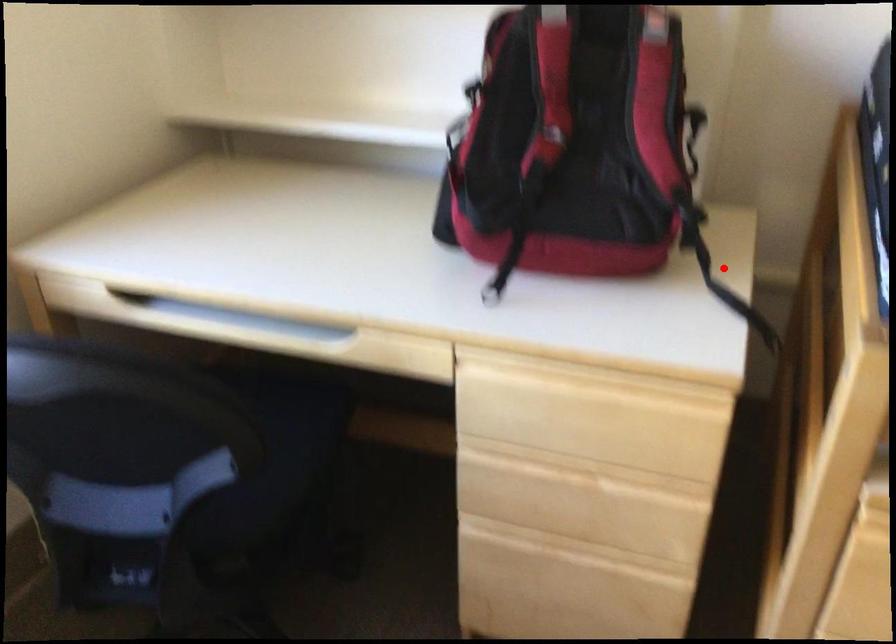
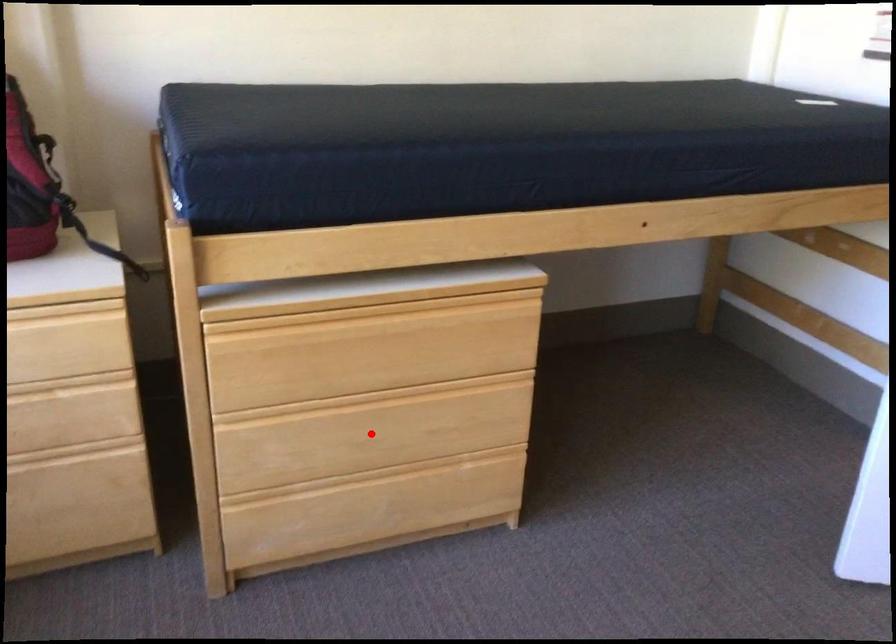
I am providing you with two images of the same scene from different viewpoints. A red point is marked on the first image and another point is marked on the second image. Are the points marked in image1 and image2 representing the same 3D position?

No